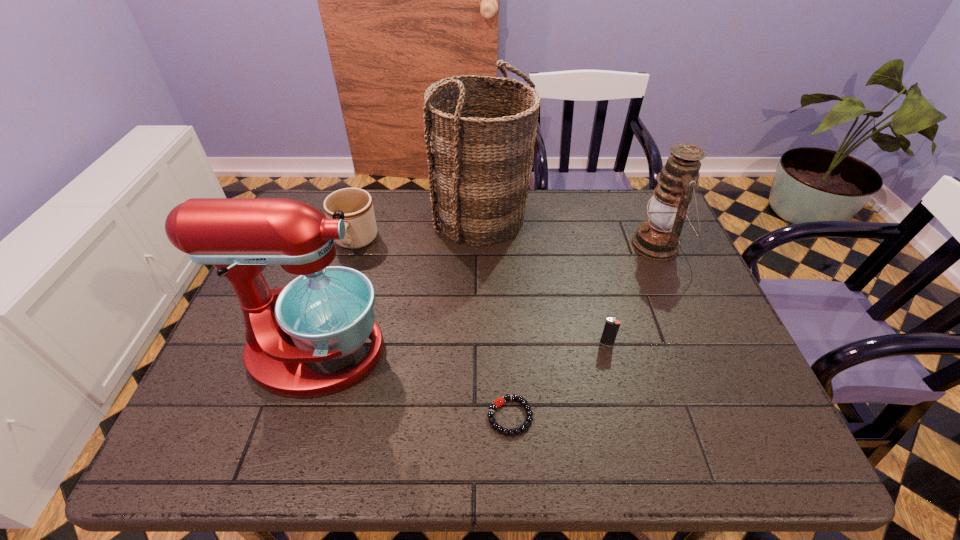
Identify the location of vacant position in the image that satisfies the following two spatial constraints: 1. on the back side of the rightmost object; 2. on the left side of the shortest object. This screenshot has width=960, height=540. (501, 245).

You are a GUI agent. You are given a task and a screenshot of the screen. Output one action in this format:
    pyautogui.click(x=<x>, y=<y>)
    Task: Click on the free space that satisfies the following two spatial constraints: 1. on the side of the mug with the handle; 2. on the right side of the third tallest object
    The image size is (960, 540).
    Given the screenshot: What is the action you would take?
    pyautogui.click(x=354, y=245)

Image resolution: width=960 pixels, height=540 pixels. I want to click on vacant region that satisfies the following two spatial constraints: 1. on the front side of the basket; 2. on the left side of the igniter, so click(482, 344).